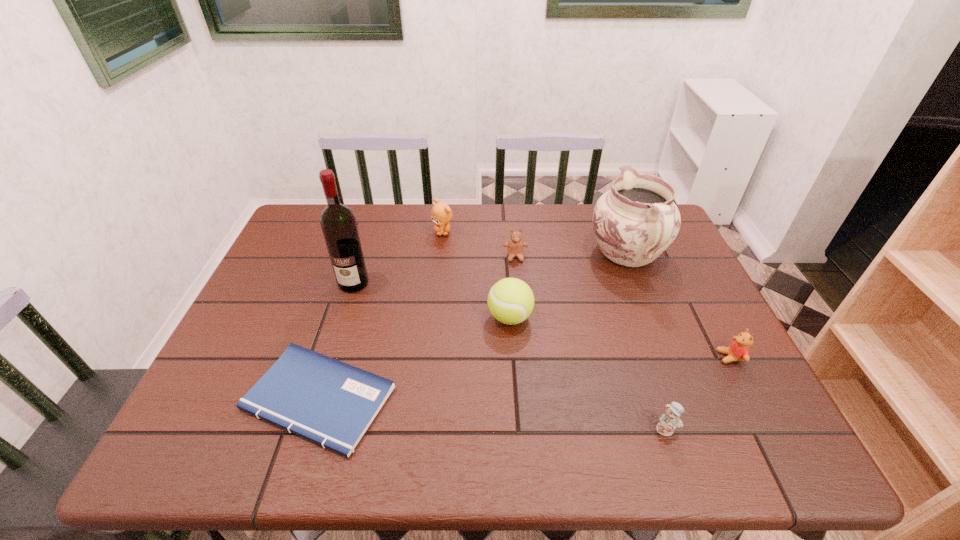
The width and height of the screenshot is (960, 540). I want to click on free space located on the spout of the seventh shortest object, so click(x=609, y=206).

Locate an element on the screen. Image resolution: width=960 pixels, height=540 pixels. free space located on the left of the tennis ball is located at coordinates (468, 317).

You are a GUI agent. You are given a task and a screenshot of the screen. Output one action in this format:
    pyautogui.click(x=<x>, y=<y>)
    Task: Click on the vacant region located on the face of the leftmost teddy bear
    This screenshot has height=540, width=960.
    Given the screenshot: What is the action you would take?
    pyautogui.click(x=433, y=321)

Where is `free space located on the face of the second farthest teddy bear`? Image resolution: width=960 pixels, height=540 pixels. free space located on the face of the second farthest teddy bear is located at coordinates (517, 284).

Where is `free space located on the front-facing side of the second nearest teddy bear`? This screenshot has width=960, height=540. free space located on the front-facing side of the second nearest teddy bear is located at coordinates (574, 357).

You are a GUI agent. You are given a task and a screenshot of the screen. Output one action in this format:
    pyautogui.click(x=<x>, y=<y>)
    Task: Click on the free space located on the front-facing side of the second nearest teddy bear
    The width and height of the screenshot is (960, 540).
    Given the screenshot: What is the action you would take?
    pyautogui.click(x=629, y=357)

You are a GUI agent. You are given a task and a screenshot of the screen. Output one action in this format:
    pyautogui.click(x=<x>, y=<y>)
    Task: Click on the free space located 0.180m on the front-facing side of the second nearest teddy bear
    
    Given the screenshot: What is the action you would take?
    pyautogui.click(x=642, y=357)

Where is `free space located 0.050m on the front-facing side of the nearest teddy bear`? This screenshot has height=540, width=960. free space located 0.050m on the front-facing side of the nearest teddy bear is located at coordinates (677, 462).

The image size is (960, 540). I want to click on vacant region located 0.360m on the right of the shortest object, so click(x=560, y=399).

Locate an element on the screen. pitcher positioned at the far edge is located at coordinates (637, 220).